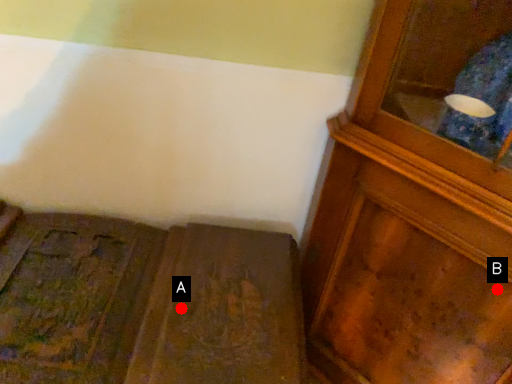
Question: Two points are circled on the image, labeled by A and B beside each circle. Which point appears farthest from the camera in this image?

Choices:
 (A) A is further
 (B) B is further

Answer: (A)